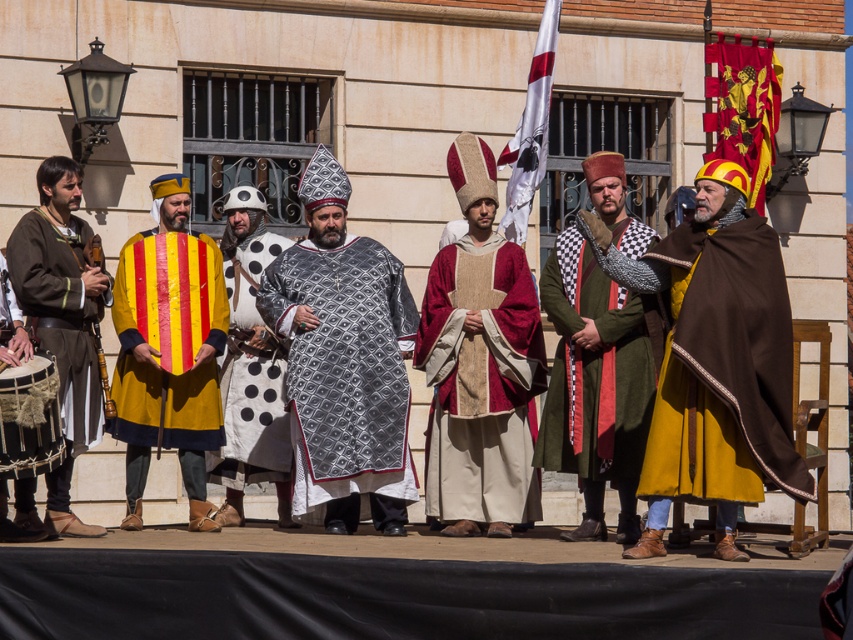
Based on the scene description and the objects provided, what does the point at coordinates (355, 381) represent?

The point at coordinates (355, 381) corresponds to the silver metallic shield at center as described in the objects description.

You are a costume designer preparing for a play. You need to decide whether the silver metallic shield at center can be displayed alongside the green woolen robe at center on a narrow stage backdrop. Based on their sizes, can they both fit side by side without overlapping?

The silver metallic shield at center might be wider than green woolen robe at center, so there is a possibility they cannot fit side by side without overlapping. Check their exact dimensions to confirm.